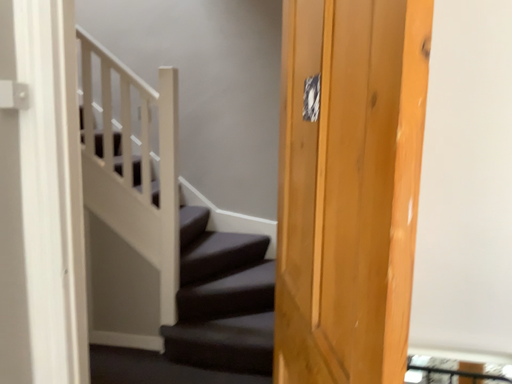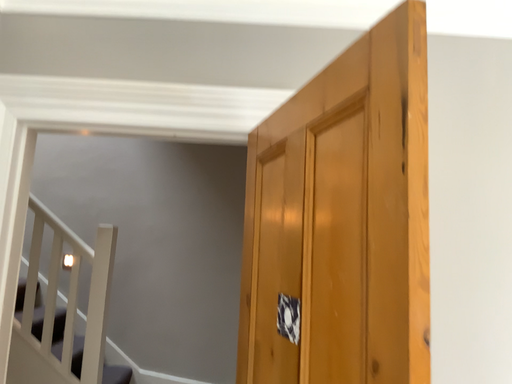
Question: How did the camera likely rotate when shooting the video?

Choices:
 (A) rotated upward
 (B) rotated downward

Answer: (A)